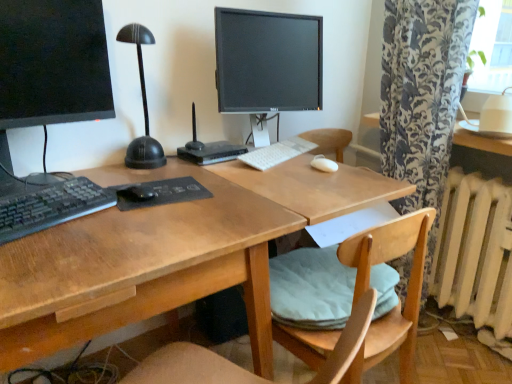
This screenshot has height=384, width=512. Find the location of `empty space that is to the right of black plastic router at center`. empty space that is to the right of black plastic router at center is located at coordinates (259, 148).